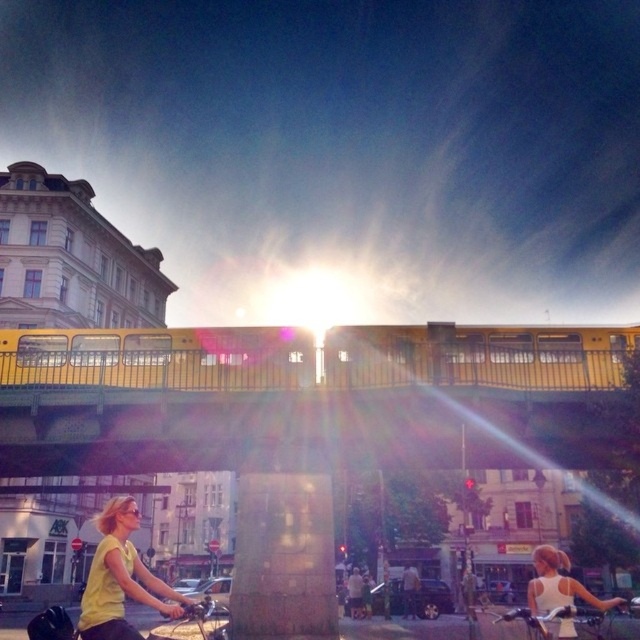
You are standing at the yellow pedestrian bridge and want to walk to the point marked as point (589, 616). However, there is an obstacle at point (157, 605). Will you encounter this obstacle before reaching your destination?

Yes, because point (157, 605) is in front of point (589, 616), so you will encounter the obstacle at point (157, 605) before reaching your destination.